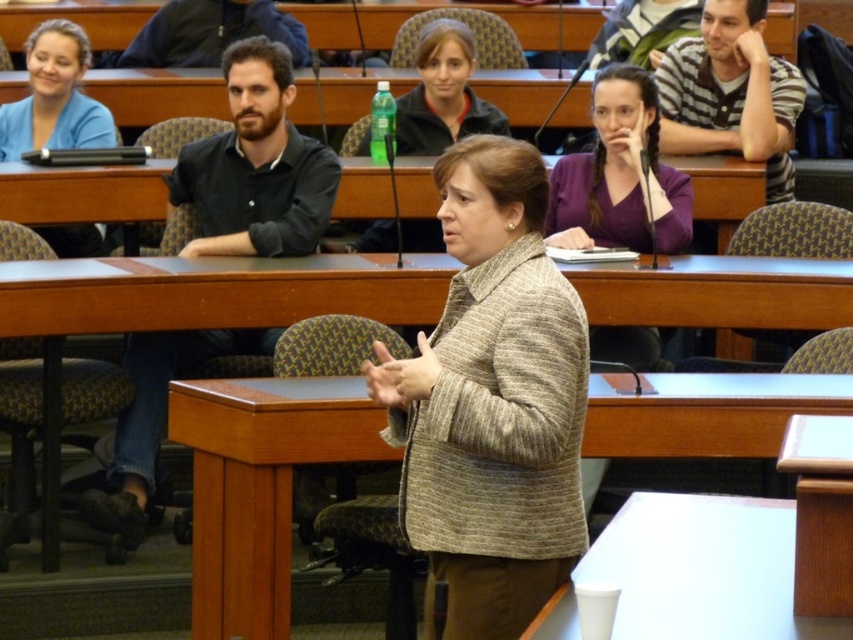
Is point (715, 93) farther from viewer compared to point (41, 68)?

Yes, point (715, 93) is behind point (41, 68).

Can you confirm if striped cotton shirt at upper right is thinner than blue cotton shirt at upper left?

In fact, striped cotton shirt at upper right might be wider than blue cotton shirt at upper left.

Where is `striped cotton shirt at upper right`? The width and height of the screenshot is (853, 640). striped cotton shirt at upper right is located at coordinates (730, 93).

Who is taller, purple matte jacket at upper right or dark blue jacket at upper left?

purple matte jacket at upper right

Is purple matte jacket at upper right to the left of dark blue jacket at upper left from the viewer's perspective?

No, purple matte jacket at upper right is not to the left of dark blue jacket at upper left.

Image resolution: width=853 pixels, height=640 pixels. Find the location of `purple matte jacket at upper right`. purple matte jacket at upper right is located at coordinates (619, 176).

Find the location of `purple matte jacket at upper right`. purple matte jacket at upper right is located at coordinates (619, 176).

Who is positioned more to the left, dark blue jacket at upper left or green plastic bottle at center?

Positioned to the left is dark blue jacket at upper left.

The width and height of the screenshot is (853, 640). What do you see at coordinates (210, 33) in the screenshot?
I see `dark blue jacket at upper left` at bounding box center [210, 33].

At what (x,y) coordinates should I click in order to perform the action: click on dark blue jacket at upper left. Please return your answer as a coordinate pair (x, y). Looking at the image, I should click on (210, 33).